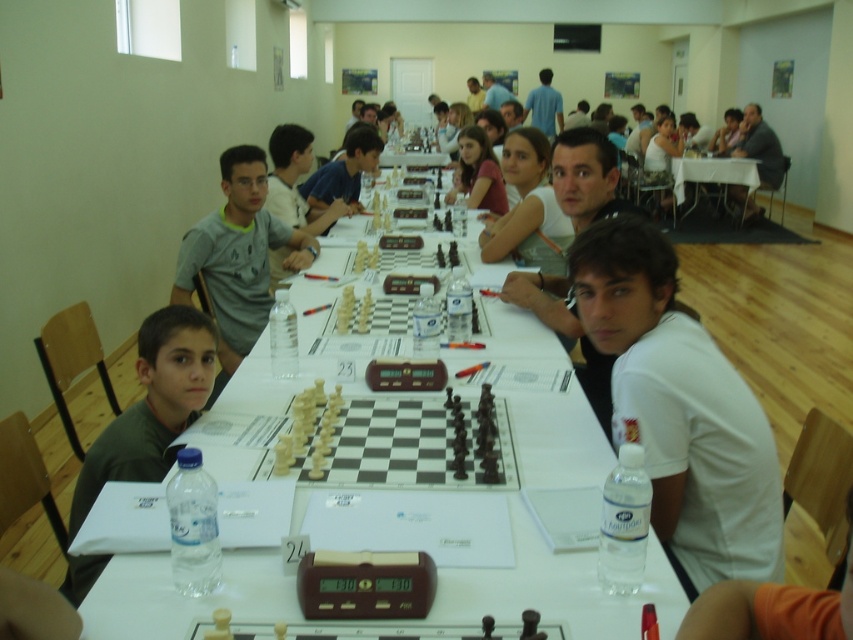
Question: From the image, what is the correct spatial relationship of white cotton shirt at center in relation to white glossy table at center?

Choices:
 (A) below
 (B) above

Answer: (B)

Question: Does white glossy table at center appear on the right side of matte black hair at center?

Choices:
 (A) yes
 (B) no

Answer: (A)

Question: Which of the following is the farthest from the observer?

Choices:
 (A) gray cotton shirt at center
 (B) white plastic table at center
 (C) white plastic chess set at center

Answer: (B)

Question: Which of the following is the farthest from the observer?

Choices:
 (A) dark green shirt at left
 (B) white plastic table at center
 (C) white plastic chess set at center
 (D) matte black hair at center

Answer: (B)

Question: Does gray cotton shirt at center appear on the right side of dark gray shirt at center?

Choices:
 (A) no
 (B) yes

Answer: (A)

Question: Which point is farther to the camera?

Choices:
 (A) (769, 148)
 (B) (492, 474)
 (C) (727, 440)
 (D) (253, 224)

Answer: (A)